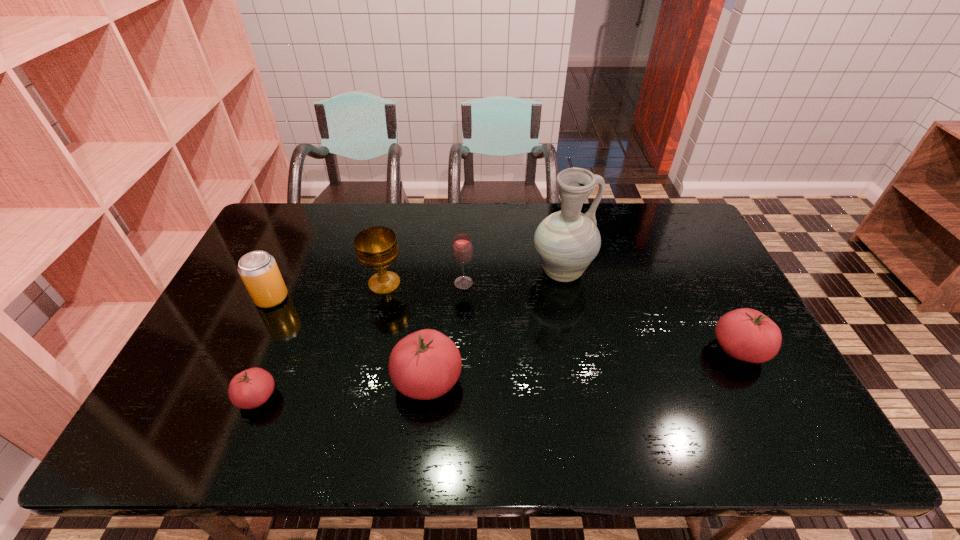
Where is `the shortest object`? The image size is (960, 540). the shortest object is located at coordinates (251, 388).

At what (x,y) coordinates should I click in order to perform the action: click on the leftmost tomato. Please return your answer as a coordinate pair (x, y). This screenshot has height=540, width=960. Looking at the image, I should click on (251, 388).

Where is `the second tomato from left to right`? The image size is (960, 540). the second tomato from left to right is located at coordinates (426, 364).

Locate an element on the screen. The height and width of the screenshot is (540, 960). the rightmost object is located at coordinates (745, 334).

At what (x,y) coordinates should I click in order to perform the action: click on the second shortest tomato. Please return your answer as a coordinate pair (x, y). This screenshot has width=960, height=540. Looking at the image, I should click on (745, 334).

The height and width of the screenshot is (540, 960). What are the coordinates of `pop (soda)` in the screenshot? It's located at (258, 270).

This screenshot has height=540, width=960. Find the location of `pitcher`. pitcher is located at coordinates (567, 241).

The image size is (960, 540). I want to click on the tallest object, so click(567, 241).

You are a GUI agent. You are given a task and a screenshot of the screen. Output one action in this format:
    pyautogui.click(x=<x>, y=<y>)
    Task: Click on the glass drink container
    
    Given the screenshot: What is the action you would take?
    pyautogui.click(x=462, y=250)

Find the location of a particular element. chalice is located at coordinates (376, 247).